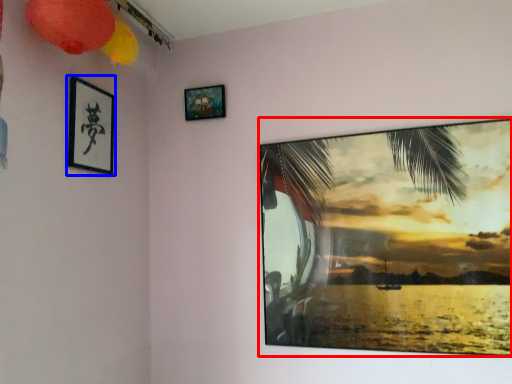
Question: Which object is further to the camera taking this photo, picture frame (highlighted by a red box) or picture frame (highlighted by a blue box)?

Choices:
 (A) picture frame
 (B) picture frame

Answer: (B)